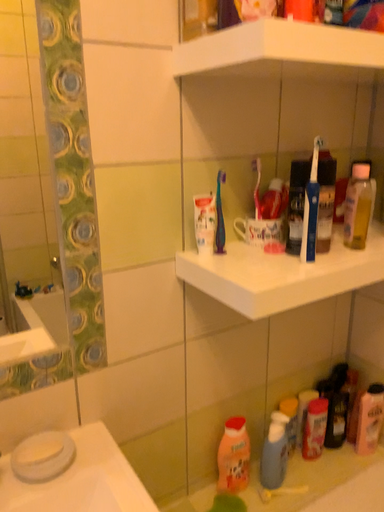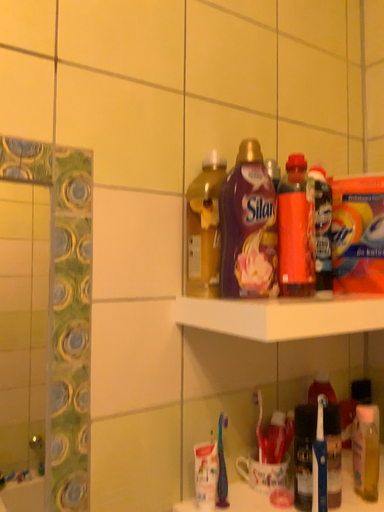
Question: How did the camera likely rotate when shooting the video?

Choices:
 (A) rotated downward
 (B) rotated upward

Answer: (B)